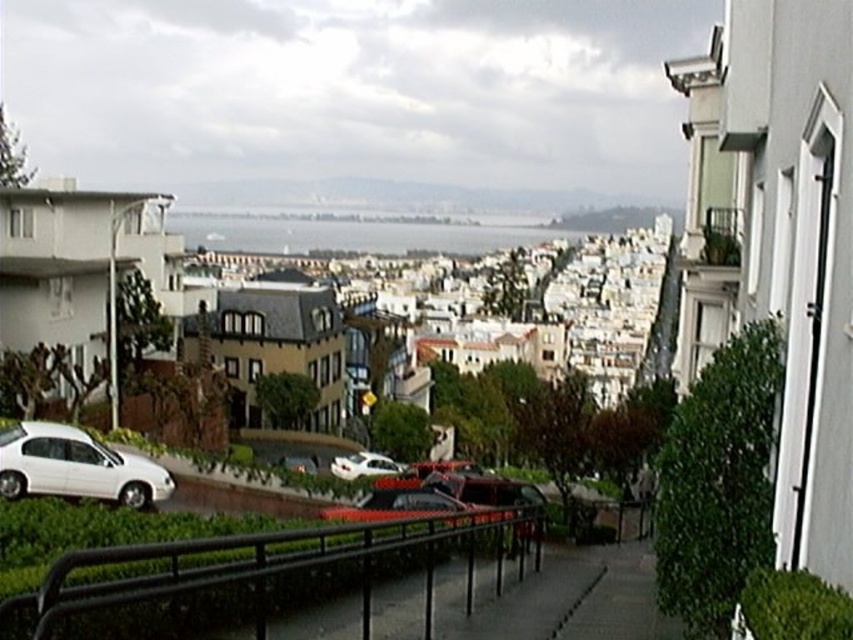
Question: Based on their relative distances, which object is nearer to the white matte building at center?

Choices:
 (A) shiny silver car at center
 (B) white matte car at lower left

Answer: (A)

Question: Is white matte car at lower left to the left of white matte car at center from the viewer's perspective?

Choices:
 (A) yes
 (B) no

Answer: (A)

Question: Can you confirm if white matte car at lower left is smaller than shiny silver car at center?

Choices:
 (A) no
 (B) yes

Answer: (A)

Question: Estimate the real-world distances between objects in this image. Which object is closer to the shiny silver car at center?

Choices:
 (A) white matte car at lower left
 (B) white matte car at center
 (C) white matte building at center

Answer: (B)

Question: Is white matte car at lower left positioned at the back of shiny silver car at center?

Choices:
 (A) yes
 (B) no

Answer: (B)

Question: Estimate the real-world distances between objects in this image. Which object is farther from the shiny silver car at center?

Choices:
 (A) black metal railing at center
 (B) white matte building at center
 (C) white matte car at center
 (D) white matte car at lower left

Answer: (B)